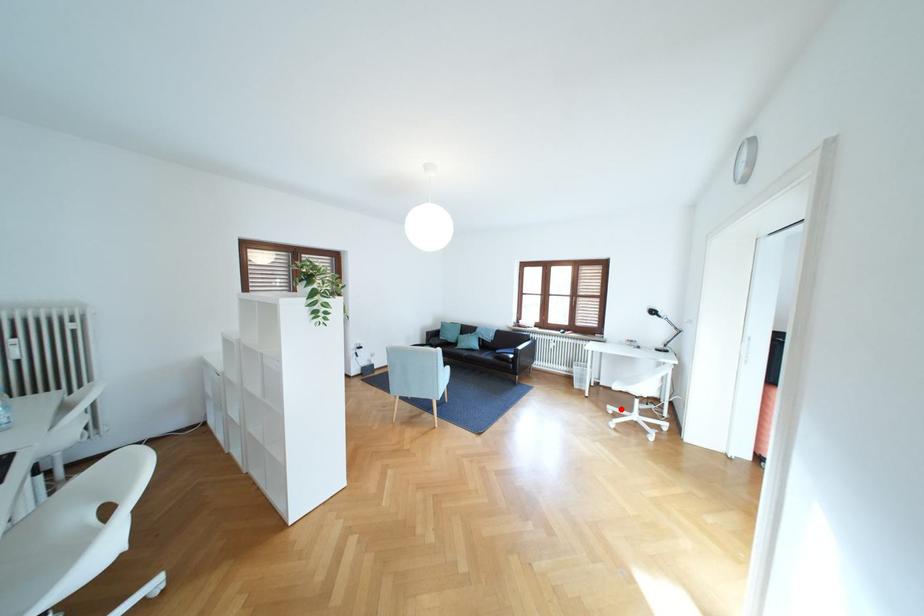
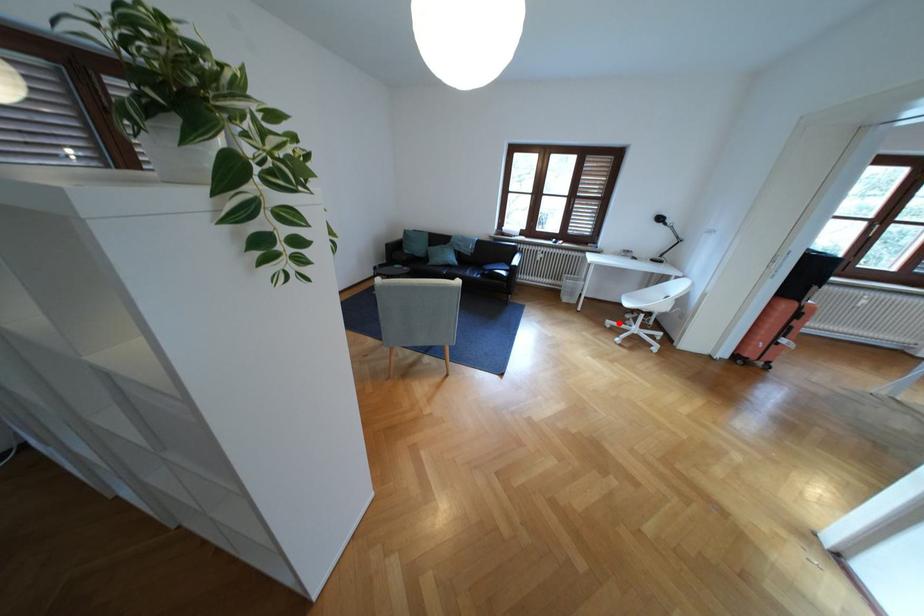
Looking at this image, I am providing you with two images of the same scene from different viewpoints. A red point is marked on the first image and another point is marked on the second image. Is the marked point in image1 the same physical position as the marked point in image2?

Yes